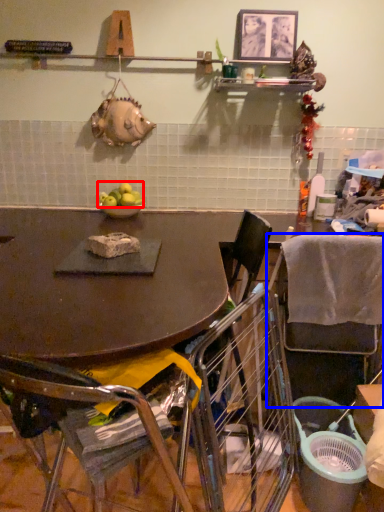
Question: Among these objects, which one is nearest to the camera, apple (highlighted by a red box) or chair (highlighted by a blue box)?

Choices:
 (A) apple
 (B) chair

Answer: (B)